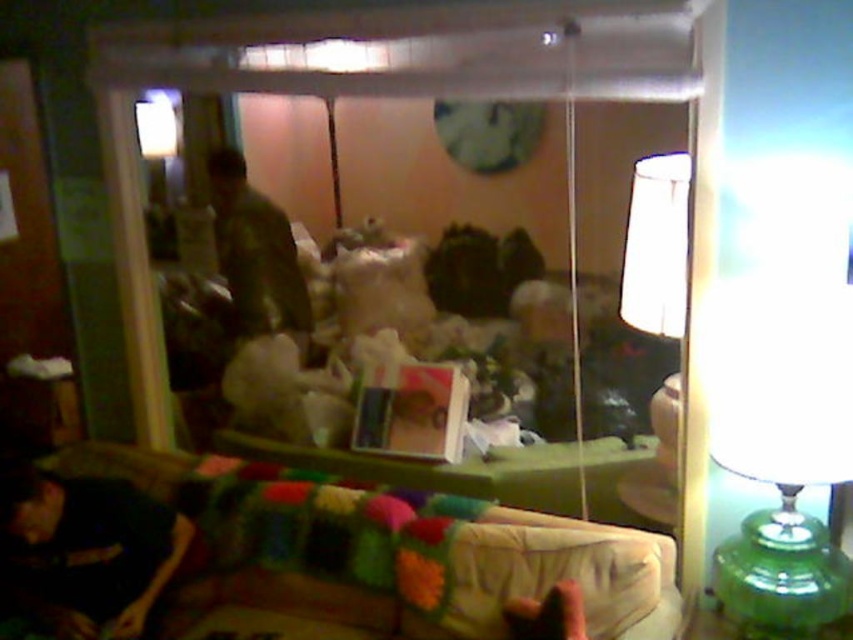
You are standing inside the room looking through the glass door or window. There are two points marked on the glass, one at point coordinates point [838,314] and another at point coordinates point [15,570]. Which point is closer to you?

Point [838,314] is closer to the camera than point [15,570].

You are sitting on the multicolored knitted couch at lower center and want to turn off the green glass lamp at right. Can you reach the lamp without getting up?

The multicolored knitted couch at lower center is shorter than the green glass lamp at right, so you might not be able to reach the lamp from the couch without standing up.

You are standing at the point marked as point (410, 577) in the room. The glass door or window is directly ahead of you. Can you see the person outside through the reflection on the glass?

Yes, the person outside is visible in the reflection on the glass because the distance between you and the glass is 6.92 feet, which allows for a clear reflection.